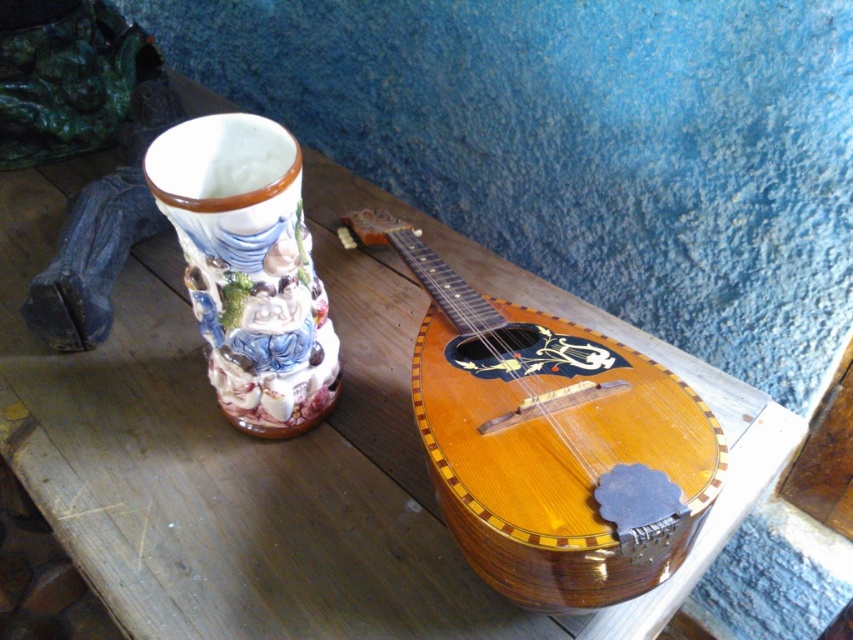
You are a photographer setting up a shoot at the rustic wooden table. You need to position a light source so that it illuminates the wooden banjo at center without casting a shadow on the decorative ceramic vase at left. Where should you place the light relative to the banjo and vase?

The wooden banjo at center is in front of the decorative ceramic vase at left, so placing the light source behind the banjo would cast its shadow away from the vase, ensuring the vase remains unobscured.

Looking at this image, you are a museum curator arranging an exhibit. You need to place a label next to the taller object between the wooden banjo at center and the decorative ceramic vase at left. Which object should you choose?

The wooden banjo at center is much taller than the decorative ceramic vase at left, so you should place the label next to the wooden banjo at center.